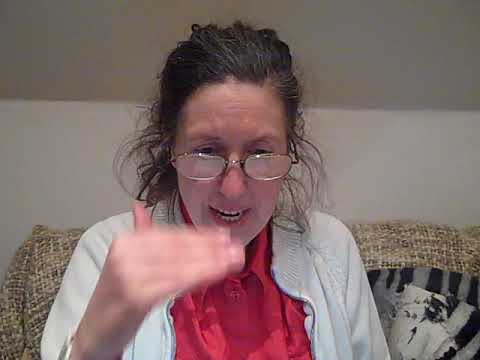
The height and width of the screenshot is (360, 480). Find the location of `couch`. couch is located at coordinates (47, 273).